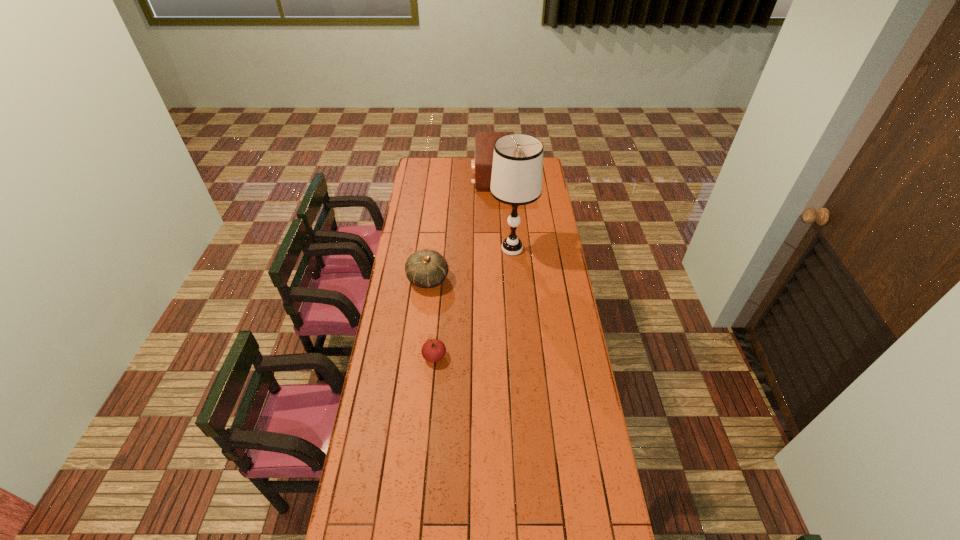
The width and height of the screenshot is (960, 540). In order to click on empty space between the third tallest object and the tomato in this screenshot , I will do `click(431, 318)`.

You are a GUI agent. You are given a task and a screenshot of the screen. Output one action in this format:
    pyautogui.click(x=<x>, y=<y>)
    Task: Click on the free space between the third tallest object and the shortest object
    This screenshot has height=540, width=960.
    Given the screenshot: What is the action you would take?
    pyautogui.click(x=431, y=318)

Locate an element on the screen. This screenshot has width=960, height=540. unoccupied position between the second shortest object and the farthest object is located at coordinates (461, 227).

Where is `free space that is in between the second farthest object and the third shortest object`? free space that is in between the second farthest object and the third shortest object is located at coordinates (502, 212).

Where is `vacant space that's between the radio receiver and the tomato`? This screenshot has height=540, width=960. vacant space that's between the radio receiver and the tomato is located at coordinates (464, 266).

Locate an element on the screen. This screenshot has height=540, width=960. vacant area that lies between the nearest object and the table lamp is located at coordinates (473, 302).

Locate an element on the screen. free space between the table lamp and the tomato is located at coordinates (473, 302).

Where is `the second closest object to the third farthest object`? the second closest object to the third farthest object is located at coordinates click(433, 350).

Identify which object is located as the second nearest to the farthest object. Please provide its 2D coordinates. Your answer should be formatted as a tuple, i.e. [(x, y)], where the tuple contains the x and y coordinates of a point satisfying the conditions above.

[(427, 268)]

This screenshot has height=540, width=960. In order to click on vacant space that satisfies the following two spatial constraints: 1. on the front panel of the radio receiver; 2. on the left side of the tallest object in this screenshot , I will do `click(495, 249)`.